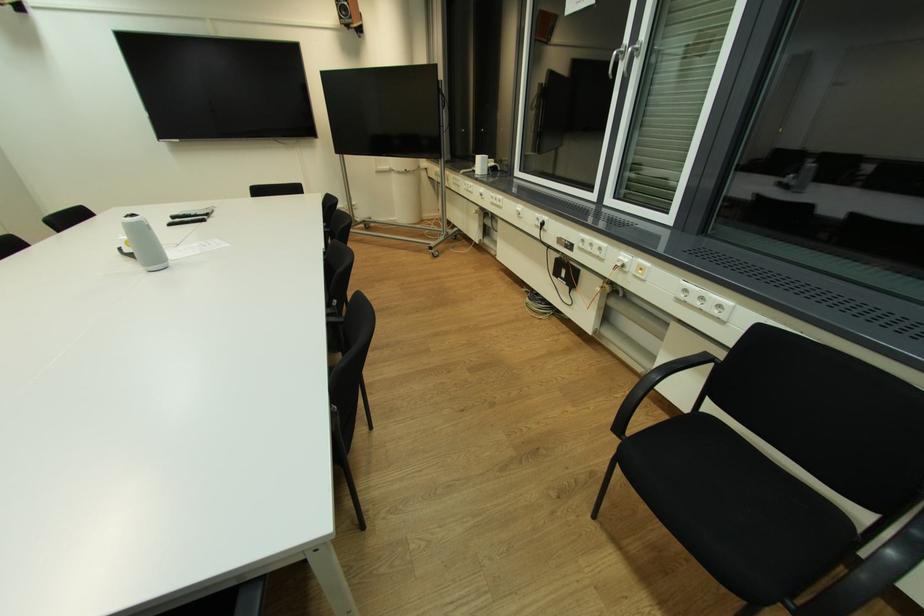
Find where to sit the black chair sitting surface. Please return your answer as a coordinate pair (x, y).

(730, 501)